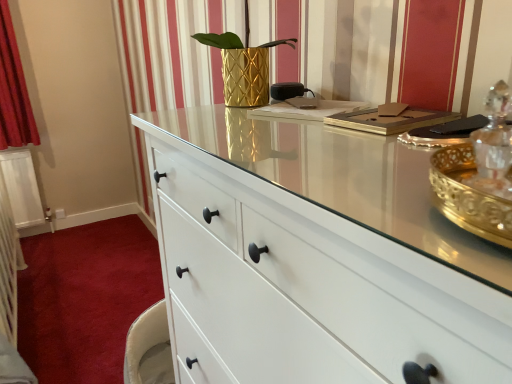
Question: Can you confirm if white matte drawer at lower left is thinner than gold textured vase at center?

Choices:
 (A) no
 (B) yes

Answer: (A)

Question: From a real-world perspective, is white matte drawer at lower left positioned over gold textured vase at center based on gravity?

Choices:
 (A) yes
 (B) no

Answer: (B)

Question: Is white matte drawer at lower left oriented towards gold textured vase at center?

Choices:
 (A) no
 (B) yes

Answer: (A)

Question: Is white matte drawer at lower left to the left of gold textured vase at center from the viewer's perspective?

Choices:
 (A) no
 (B) yes

Answer: (B)

Question: From the image's perspective, would you say white matte drawer at lower left is positioned over gold textured vase at center?

Choices:
 (A) yes
 (B) no

Answer: (B)

Question: Is white matte drawer at lower left wider than gold textured vase at center?

Choices:
 (A) no
 (B) yes

Answer: (B)

Question: Can you confirm if gold textured vase at center is smaller than white matte drawer at lower left?

Choices:
 (A) yes
 (B) no

Answer: (A)

Question: Is gold textured vase at center further to camera compared to white matte drawer at lower left?

Choices:
 (A) no
 (B) yes

Answer: (A)

Question: Is gold textured vase at center not near white matte drawer at lower left?

Choices:
 (A) no
 (B) yes

Answer: (B)

Question: Does gold textured vase at center have a greater width compared to white matte drawer at lower left?

Choices:
 (A) no
 (B) yes

Answer: (A)

Question: Is gold textured vase at center in front of white matte drawer at lower left?

Choices:
 (A) no
 (B) yes

Answer: (B)

Question: Is gold textured vase at center positioned with its back to white matte drawer at lower left?

Choices:
 (A) no
 (B) yes

Answer: (A)

Question: From a real-world perspective, relative to gold textured vase at center, is white matte drawer at lower left vertically above or below?

Choices:
 (A) above
 (B) below

Answer: (B)